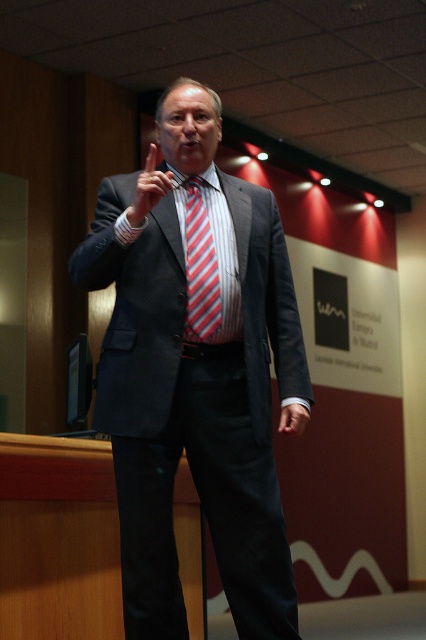
You are a photographer setting up for a presentation. You need to ensure that the matte red tie at center and the satin smooth hand at center are in focus simultaneously. Given that your camera can only maintain focus within a 40 inch range, will both objects be in focus?

The distance between the matte red tie at center and the satin smooth hand at center is 38.79 inches, which is within the camera focus range of 40 inches. Therefore, both objects will be in focus.

You are a tailor measuring the distance between the matte black suit at center and the striped fabric tie at center for alterations. Can you fit a 10 inch long pin between them?

The distance between the matte black suit at center and the striped fabric tie at center is 9.96 inches, which is slightly less than 10 inches. Therefore, a 10 inch long pin would not fit between them as it would extend beyond the available space.